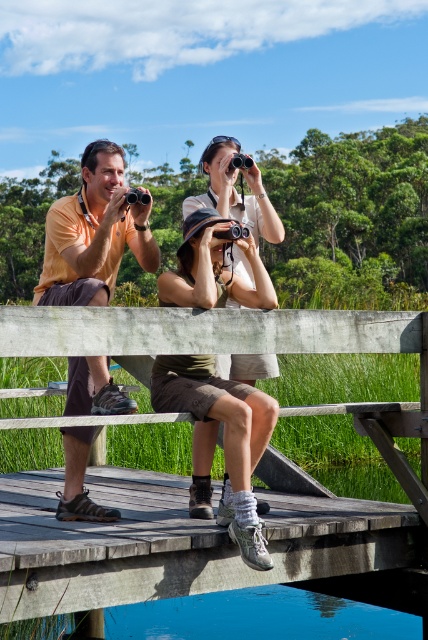
Question: Is matte orange shirt at center wider than khaki cotton shorts at center?

Choices:
 (A) no
 (B) yes

Answer: (B)

Question: Which point is closer to the camera taking this photo?

Choices:
 (A) (232, 284)
 (B) (95, 216)
 (C) (241, 157)

Answer: (B)

Question: Is the position of matte orange shirt at center more distant than that of matte black camera at center?

Choices:
 (A) yes
 (B) no

Answer: (B)

Question: Among these objects, which one is nearest to the camera?

Choices:
 (A) black plastic camera at upper left
 (B) matte yellow shirt at left

Answer: (B)

Question: Is khaki cotton shorts at center positioned before black plastic camera at upper center?

Choices:
 (A) yes
 (B) no

Answer: (A)

Question: Which point is farther to the camera?

Choices:
 (A) wooden bench at center
 (B) matte black camera at center
 (C) matte yellow shirt at left

Answer: (B)